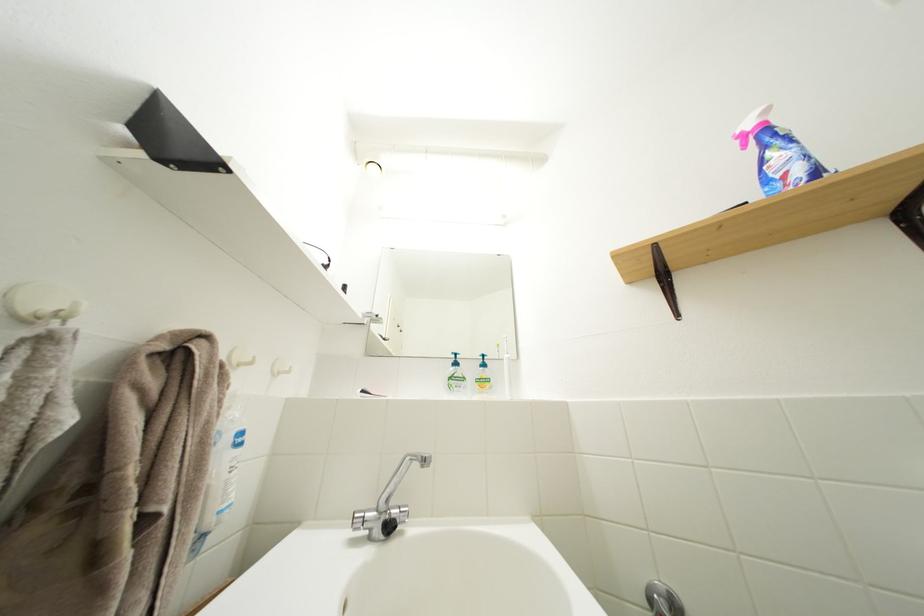
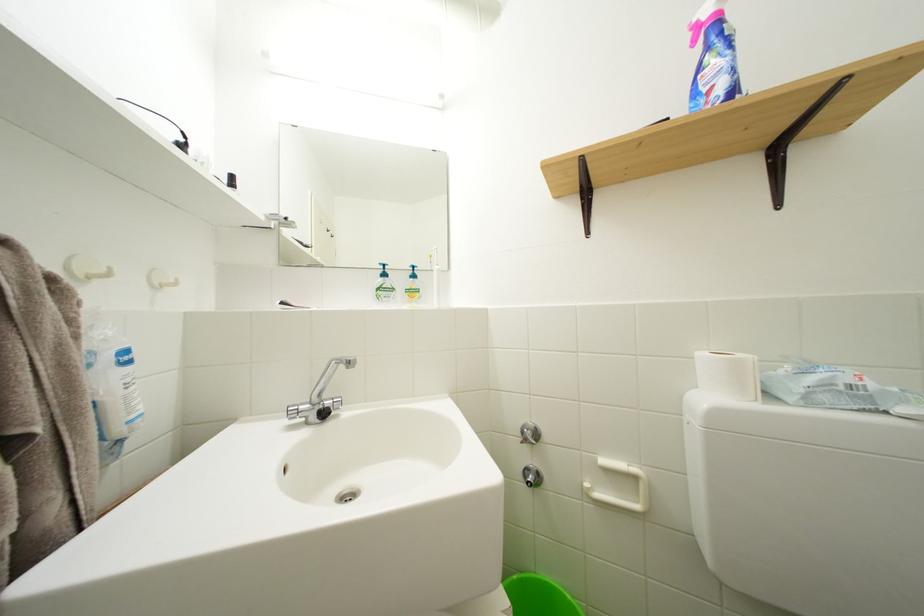
Question: Based on the continuous images, in which direction is the camera rotating? Reply with the corresponding letter.

Choices:
 (A) Left
 (B) Right
 (C) Up
 (D) Down

Answer: (D)